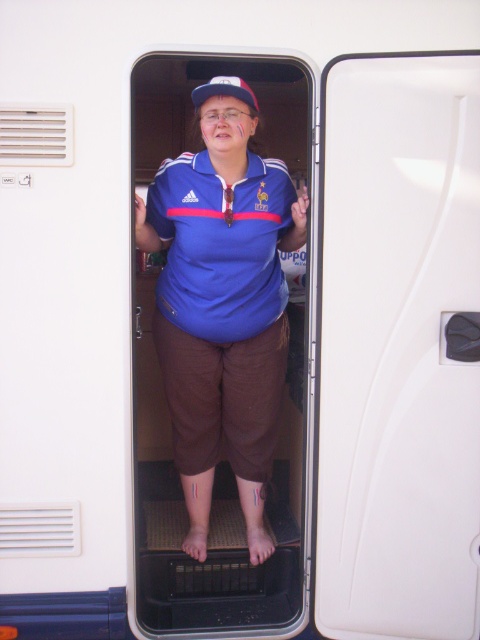
Question: Which object appears farthest from the camera in this image?

Choices:
 (A) blue fabric shirt at center
 (B) blue fabric baseball cap at center

Answer: (B)

Question: Which point is farther to the camera?

Choices:
 (A) blue matte polo shirt at center
 (B) blue fabric baseball cap at center
 (C) blue fabric shirt at center

Answer: (A)

Question: Does blue matte polo shirt at center have a lesser width compared to blue fabric baseball cap at center?

Choices:
 (A) yes
 (B) no

Answer: (B)

Question: Does blue fabric shirt at center have a lesser width compared to blue fabric baseball cap at center?

Choices:
 (A) yes
 (B) no

Answer: (B)

Question: Which object is farther from the camera taking this photo?

Choices:
 (A) white plastic door at center
 (B) blue fabric baseball cap at center

Answer: (B)

Question: Is white plastic door at center in front of blue fabric shirt at center?

Choices:
 (A) no
 (B) yes

Answer: (B)